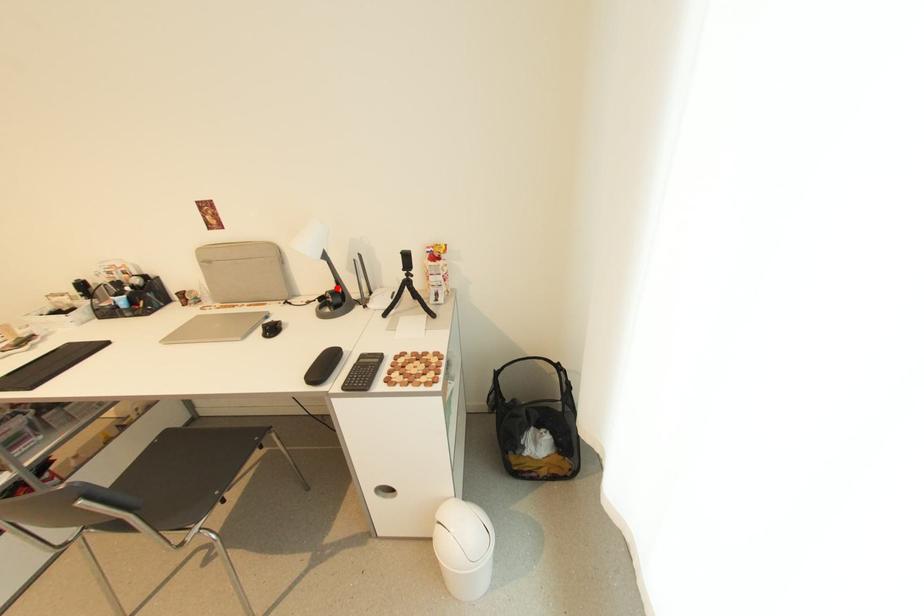
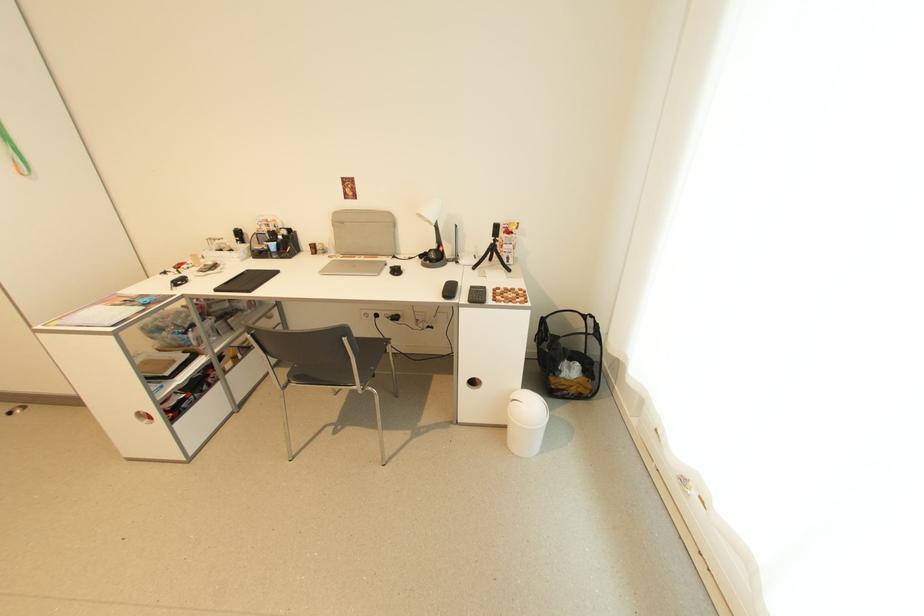
Where in the second image is the point corresponding to the highlighted location from the first image?

(439, 248)